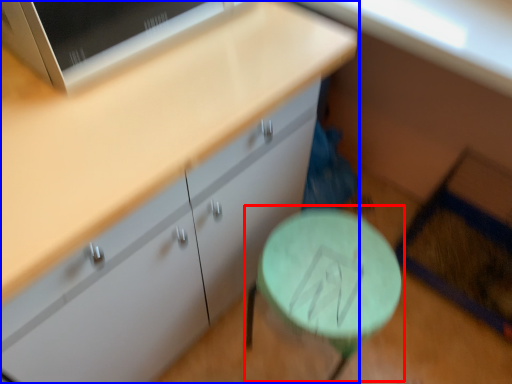
Question: Which object appears closest to the camera in this image, round table (highlighted by a red box) or cabinetry (highlighted by a blue box)?

Choices:
 (A) round table
 (B) cabinetry

Answer: (B)